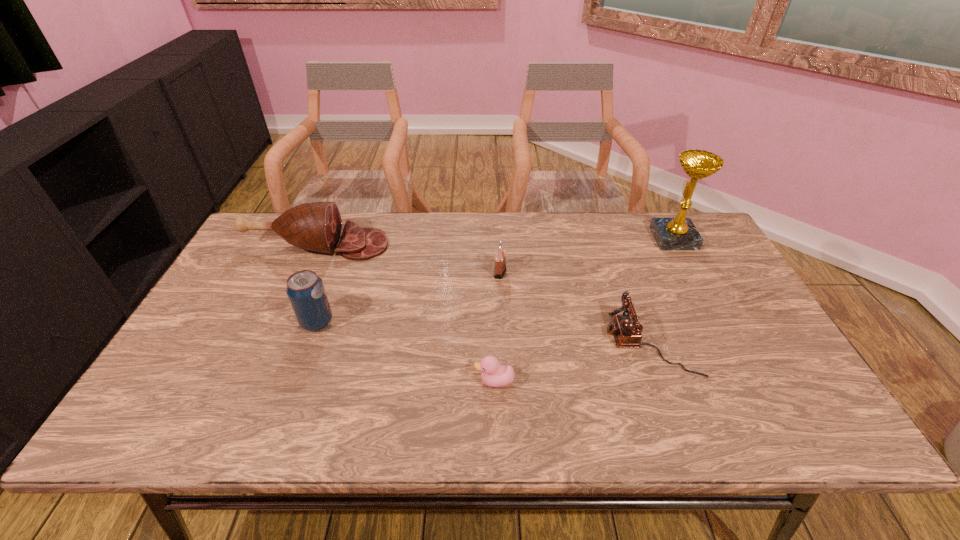
This screenshot has width=960, height=540. I want to click on free space at the near right corner, so click(x=792, y=434).

Where is `free space that is in between the shortest object and the pop soda`? The height and width of the screenshot is (540, 960). free space that is in between the shortest object and the pop soda is located at coordinates (406, 352).

Locate an element on the screen. This screenshot has width=960, height=540. free point between the duckling and the tallest object is located at coordinates tap(584, 310).

In order to click on blank region between the second object from right to left and the ham in this screenshot , I will do `click(484, 294)`.

At what (x,y) coordinates should I click in order to perform the action: click on free spot between the padlock and the shortest object. Please return your answer as a coordinate pair (x, y). This screenshot has width=960, height=540. Looking at the image, I should click on (497, 327).

This screenshot has width=960, height=540. I want to click on free spot between the shortest object and the rightmost object, so click(x=584, y=310).

Identify the location of vacant region between the award and the ham. This screenshot has height=540, width=960. (495, 242).

Identify the location of free space between the shortest object and the tallest object. The width and height of the screenshot is (960, 540). (584, 310).

Locate an element on the screen. free spot between the telephone and the ham is located at coordinates (484, 294).

Locate an element on the screen. vacant area that lies between the third farthest object and the fifth object from left to right is located at coordinates (575, 307).